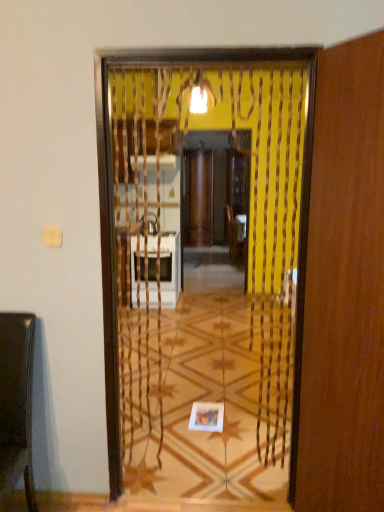
The image size is (384, 512). I want to click on shiny brown chair at left, so click(x=16, y=403).

Where is `wooden screen door at center, acting as the 1th screen door starting from the back`? The image size is (384, 512). wooden screen door at center, acting as the 1th screen door starting from the back is located at coordinates (213, 205).

Does wooden screen door at right, positioned as the second screen door in back-to-front order, have a larger size compared to shiny brown chair at left?

Yes, wooden screen door at right, positioned as the second screen door in back-to-front order, is bigger than shiny brown chair at left.

Is the position of wooden screen door at right, positioned as the second screen door in back-to-front order, more distant than that of shiny brown chair at left?

No, it is in front of shiny brown chair at left.

Is wooden screen door at right, which is the 1th screen door from front to back, not near shiny brown chair at left?

Yes, wooden screen door at right, which is the 1th screen door from front to back, is far from shiny brown chair at left.

In terms of width, does wooden screen door at right, which is the 1th screen door from front to back, look wider or thinner when compared to wooden screen door at center, acting as the 1th screen door starting from the back?

wooden screen door at right, which is the 1th screen door from front to back, is thinner than wooden screen door at center, acting as the 1th screen door starting from the back.

Is wooden screen door at right, which is the 1th screen door from front to back, shorter than wooden screen door at center, the 2th screen door when ordered from front to back?

Correct, wooden screen door at right, which is the 1th screen door from front to back, is not as tall as wooden screen door at center, the 2th screen door when ordered from front to back.

Who is bigger, wooden screen door at right, positioned as the second screen door in back-to-front order, or wooden screen door at center, the 2th screen door when ordered from front to back?

wooden screen door at center, the 2th screen door when ordered from front to back.

Does wooden screen door at center, acting as the 1th screen door starting from the back, turn towards wooden screen door at right, which is the 1th screen door from front to back?

Yes, wooden screen door at center, acting as the 1th screen door starting from the back, is turned towards wooden screen door at right, which is the 1th screen door from front to back.

Which is less distant, (x=245, y=158) or (x=368, y=277)?

Point (x=245, y=158) is positioned farther from the camera compared to point (x=368, y=277).

Looking at this image, does wooden screen door at center, acting as the 1th screen door starting from the back, have a greater width compared to wooden screen door at right, positioned as the second screen door in back-to-front order?

Indeed, wooden screen door at center, acting as the 1th screen door starting from the back, has a greater width compared to wooden screen door at right, positioned as the second screen door in back-to-front order.

Between wooden screen door at center, the 2th screen door when ordered from front to back, and wooden screen door at right, which is the 1th screen door from front to back, which one has larger size?

Bigger between the two is wooden screen door at center, the 2th screen door when ordered from front to back.

Would you say wooden screen door at center, the 2th screen door when ordered from front to back, contains shiny brown chair at left?

No.

From a real-world perspective, count 2nd screen doors upward from the shiny brown chair at left and point to it. Please provide its 2D coordinates.

[(213, 205)]

Which is more to the left, wooden screen door at center, acting as the 1th screen door starting from the back, or shiny brown chair at left?

shiny brown chair at left is more to the left.

Is point (208, 240) closer or farther from the camera than point (20, 338)?

Point (208, 240) appears to be farther away from the viewer than point (20, 338).

Considering the relative sizes of shiny brown chair at left and wooden screen door at center, acting as the 1th screen door starting from the back, in the image provided, is shiny brown chair at left shorter than wooden screen door at center, acting as the 1th screen door starting from the back,?

Yes.

In terms of width, does shiny brown chair at left look wider or thinner when compared to wooden screen door at center, the 2th screen door when ordered from front to back?

shiny brown chair at left is wider than wooden screen door at center, the 2th screen door when ordered from front to back.

Is shiny brown chair at left to the left or to the right of wooden screen door at center, acting as the 1th screen door starting from the back, in the image?

Clearly, shiny brown chair at left is on the left of wooden screen door at center, acting as the 1th screen door starting from the back, in the image.

Looking at their sizes, would you say shiny brown chair at left is wider or thinner than wooden screen door at right, positioned as the second screen door in back-to-front order?

shiny brown chair at left is wider than wooden screen door at right, positioned as the second screen door in back-to-front order.

From a real-world perspective, between shiny brown chair at left and wooden screen door at right, which is the 1th screen door from front to back, who is vertically higher?

wooden screen door at right, which is the 1th screen door from front to back, is physically above.

Is point (5, 443) behind point (371, 372)?

Yes, point (5, 443) is farther from viewer.

Relative to wooden screen door at right, which is the 1th screen door from front to back, is shiny brown chair at left in front or behind?

shiny brown chair at left is positioned farther from the viewer than wooden screen door at right, which is the 1th screen door from front to back.

Locate an element on the screen. The image size is (384, 512). screen door located in front of the shiny brown chair at left is located at coordinates (344, 288).

The height and width of the screenshot is (512, 384). In order to click on screen door on the left of wooden screen door at right, which is the 1th screen door from front to back in this screenshot , I will do (x=213, y=205).

Looking at the image, which one is located further to wooden screen door at right, positioned as the second screen door in back-to-front order, shiny brown chair at left or wooden screen door at center, acting as the 1th screen door starting from the back?

wooden screen door at center, acting as the 1th screen door starting from the back, lies further to wooden screen door at right, positioned as the second screen door in back-to-front order, than the other object.

Which object lies nearer to the anchor point wooden screen door at right, positioned as the second screen door in back-to-front order, wooden screen door at center, the 2th screen door when ordered from front to back, or shiny brown chair at left?

Among the two, shiny brown chair at left is located nearer to wooden screen door at right, positioned as the second screen door in back-to-front order.

Based on their spatial positions, is shiny brown chair at left or wooden screen door at right, positioned as the second screen door in back-to-front order, further from wooden screen door at center, the 2th screen door when ordered from front to back?

wooden screen door at right, positioned as the second screen door in back-to-front order, is further to wooden screen door at center, the 2th screen door when ordered from front to back.

Estimate the real-world distances between objects in this image. Which object is closer to shiny brown chair at left, wooden screen door at right, positioned as the second screen door in back-to-front order, or wooden screen door at center, the 2th screen door when ordered from front to back?

wooden screen door at right, positioned as the second screen door in back-to-front order, is closer to shiny brown chair at left.

Estimate the real-world distances between objects in this image. Which object is further from shiny brown chair at left, wooden screen door at center, the 2th screen door when ordered from front to back, or wooden screen door at right, which is the 1th screen door from front to back?

wooden screen door at center, the 2th screen door when ordered from front to back, is further to shiny brown chair at left.

Looking at the image, which one is located closer to wooden screen door at center, the 2th screen door when ordered from front to back, wooden screen door at right, which is the 1th screen door from front to back, or shiny brown chair at left?

Based on the image, shiny brown chair at left appears to be nearer to wooden screen door at center, the 2th screen door when ordered from front to back.

Identify the location of furniture between wooden screen door at right, positioned as the second screen door in back-to-front order, and wooden screen door at center, acting as the 1th screen door starting from the back, in the front-back direction. (16, 403).